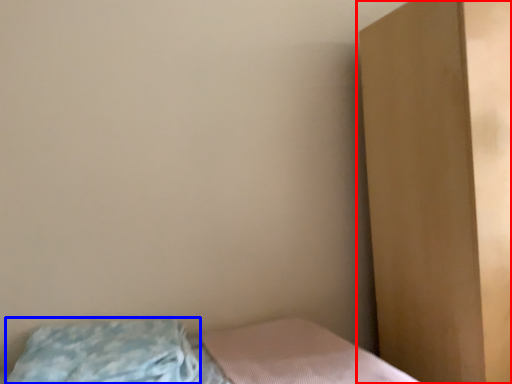
Question: Which object is further to the camera taking this photo, dresser (highlighted by a red box) or pillow (highlighted by a blue box)?

Choices:
 (A) dresser
 (B) pillow

Answer: (A)